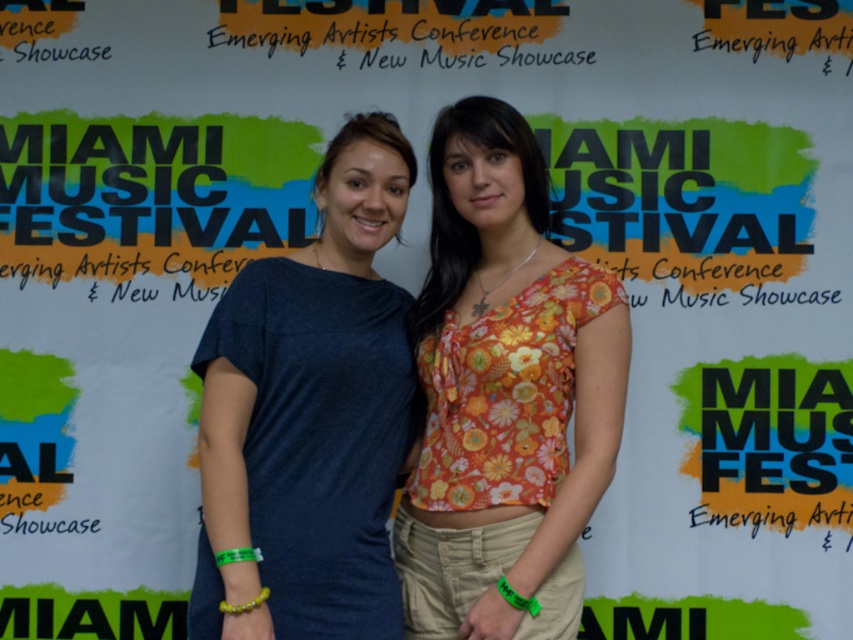
You are at the Miami Music Festival and want to take a photo with the floral fabric top at center. If your camera can focus on objects up to 3 meters away, will you be able to take a clear photo?

The floral fabric top at center is 2.77 meters away from the viewer. Since the camera can focus up to 3 meters, you can take a clear photo as the distance is within the camera range.